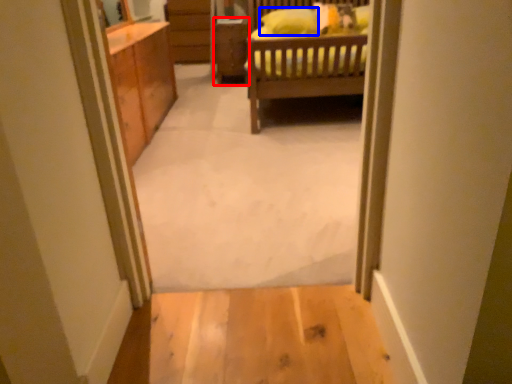
Question: Which point is further to the camera, cabinetry (highlighted by a red box) or pillow (highlighted by a blue box)?

Choices:
 (A) cabinetry
 (B) pillow

Answer: (A)